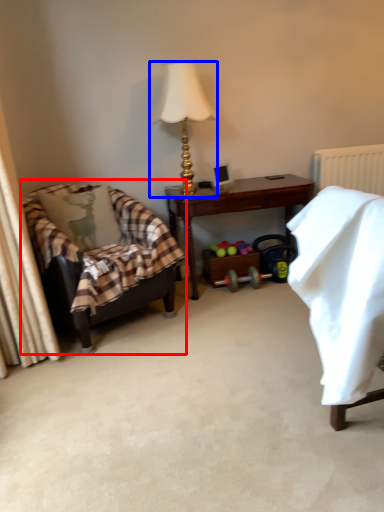
Question: Which point is further to the camera, chair (highlighted by a red box) or lamp (highlighted by a blue box)?

Choices:
 (A) chair
 (B) lamp

Answer: (B)